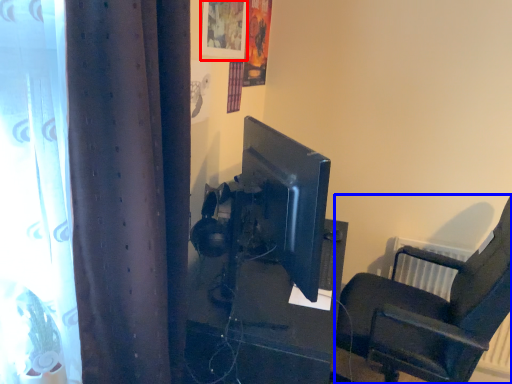
Question: Which object appears closest to the camera in this image, picture frame (highlighted by a red box) or chair (highlighted by a blue box)?

Choices:
 (A) picture frame
 (B) chair

Answer: (B)